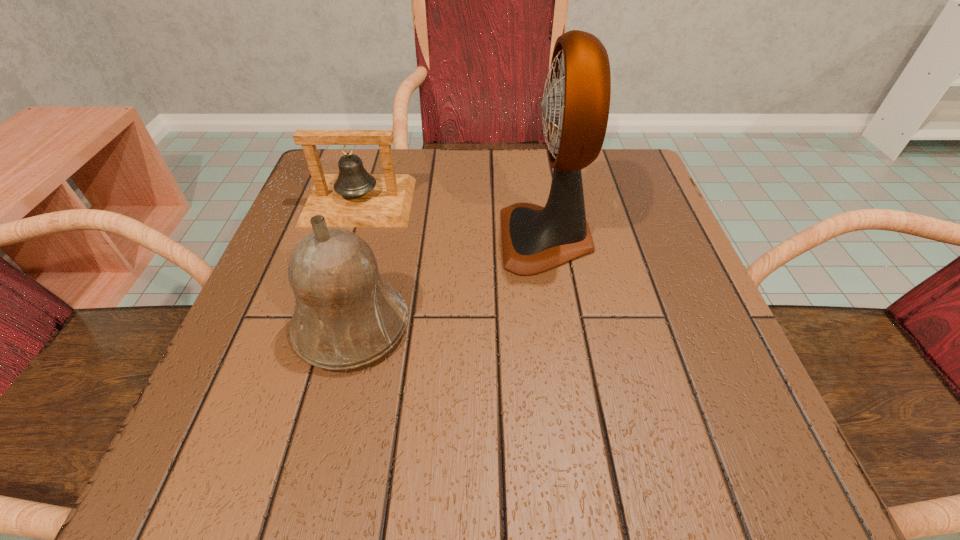
Where is `the tallest object`? The height and width of the screenshot is (540, 960). the tallest object is located at coordinates (575, 107).

You are a GUI agent. You are given a task and a screenshot of the screen. Output one action in this format:
    pyautogui.click(x=<x>, y=<y>)
    Task: Click on the rightmost object
    Image resolution: width=960 pixels, height=540 pixels.
    Given the screenshot: What is the action you would take?
    pyautogui.click(x=575, y=107)

At what (x,y) coordinates should I click in order to perform the action: click on the nearer bell. Please return your answer as a coordinate pair (x, y). Looking at the image, I should click on (347, 315).

The height and width of the screenshot is (540, 960). What are the coordinates of `the taller bell` in the screenshot? It's located at (347, 315).

Identify the location of the shorter bell. Image resolution: width=960 pixels, height=540 pixels. (353, 198).

This screenshot has width=960, height=540. In order to click on the shortest object in this screenshot , I will do `click(353, 198)`.

What are the coordinates of `vacant space located on the front-facing side of the fan` in the screenshot? It's located at (306, 238).

Locate an element on the screen. Image resolution: width=960 pixels, height=540 pixels. free space located on the front-facing side of the fan is located at coordinates (380, 238).

Locate an element on the screen. The height and width of the screenshot is (540, 960). free space located on the front-facing side of the fan is located at coordinates (375, 238).

You are a GUI agent. You are given a task and a screenshot of the screen. Output one action in this format:
    pyautogui.click(x=<x>, y=<y>)
    Task: Click on the vacant space located on the back of the nearest object
    Image resolution: width=960 pixels, height=540 pixels.
    Given the screenshot: What is the action you would take?
    pyautogui.click(x=382, y=206)